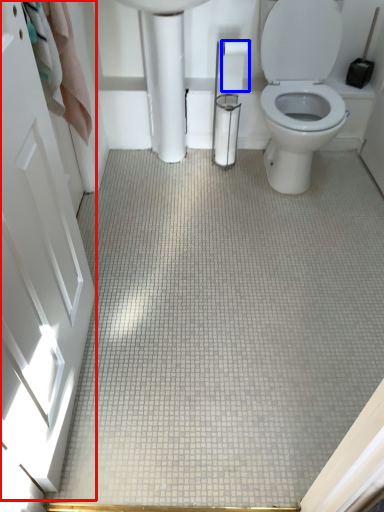
Question: Which object is further to the camera taking this photo, screen door (highlighted by a red box) or toilet paper (highlighted by a blue box)?

Choices:
 (A) screen door
 (B) toilet paper

Answer: (B)